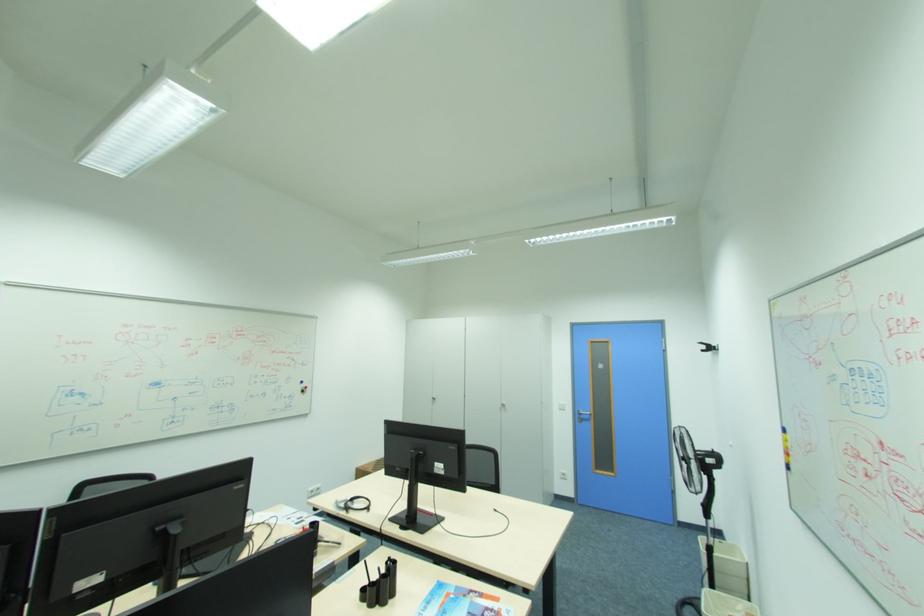
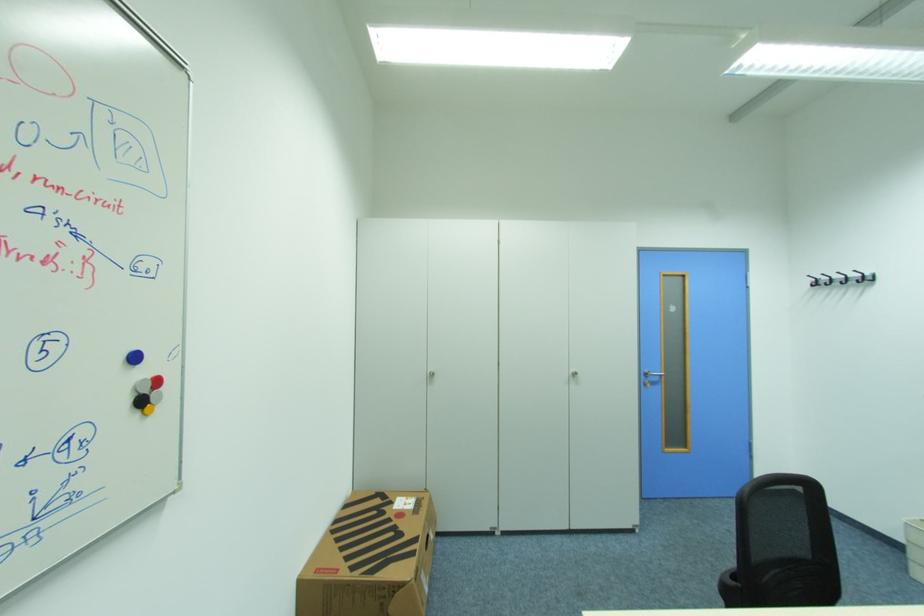
Where in the second image is the point corresponding to [311,387] from the first image?

(162, 382)